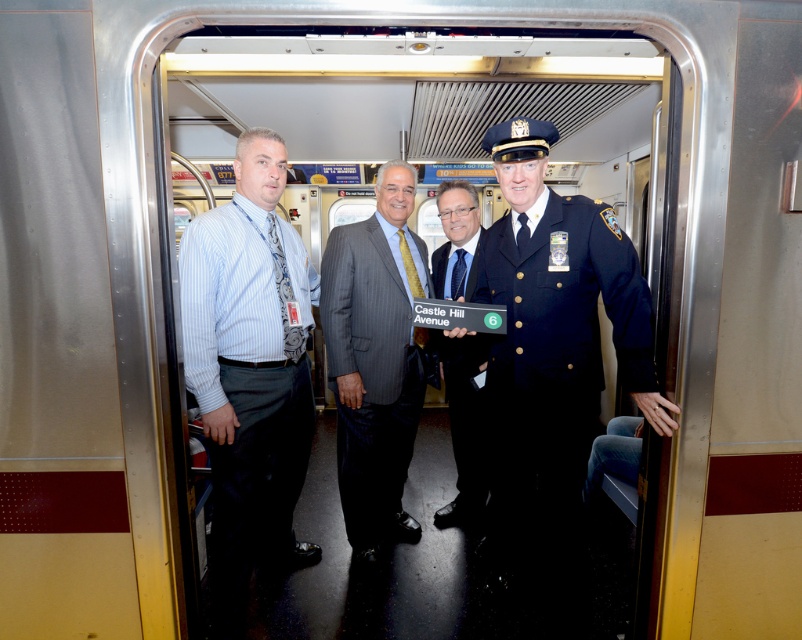
Does gray pinstripe suit at center have a larger size compared to dark blue uniform at center?

Actually, gray pinstripe suit at center might be smaller than dark blue uniform at center.

Who is taller, gray pinstripe suit at center or dark blue uniform at center?

gray pinstripe suit at center

Which is behind, point (346, 484) or point (460, 499)?

Point (460, 499)

This screenshot has height=640, width=802. What are the coordinates of `gray pinstripe suit at center` in the screenshot? It's located at (375, 358).

Does light blue striped shirt at left lie in front of dark blue uniform at center?

That is True.

Consider the image. Who is higher up, light blue striped shirt at left or dark blue uniform at center?

Positioned higher is dark blue uniform at center.

This screenshot has width=802, height=640. I want to click on light blue striped shirt at left, so click(250, 362).

Between light blue striped shirt at left and gray pinstripe suit at center, which one appears on the right side from the viewer's perspective?

gray pinstripe suit at center

Does light blue striped shirt at left appear over gray pinstripe suit at center?

Actually, light blue striped shirt at left is below gray pinstripe suit at center.

Where is `light blue striped shirt at left`? The image size is (802, 640). light blue striped shirt at left is located at coordinates pyautogui.click(x=250, y=362).